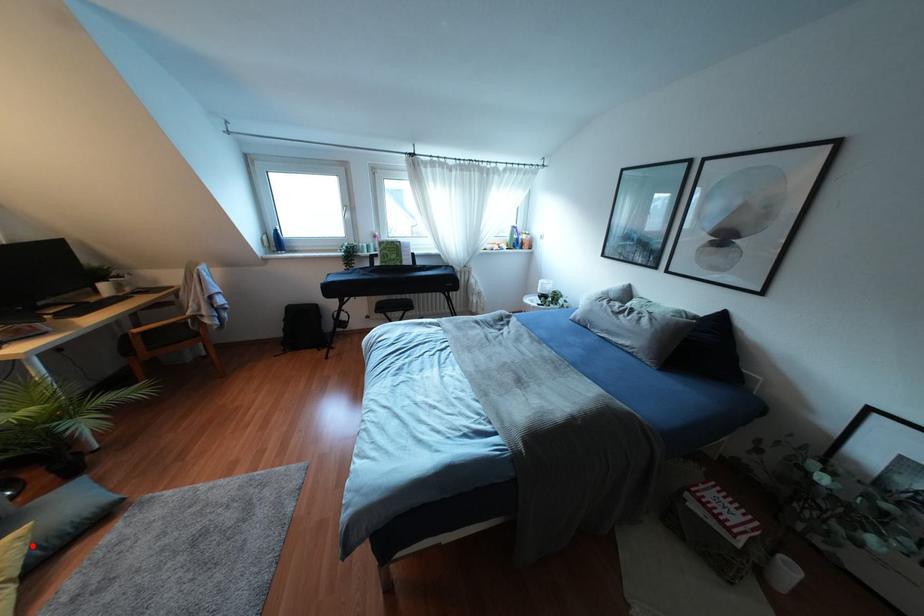
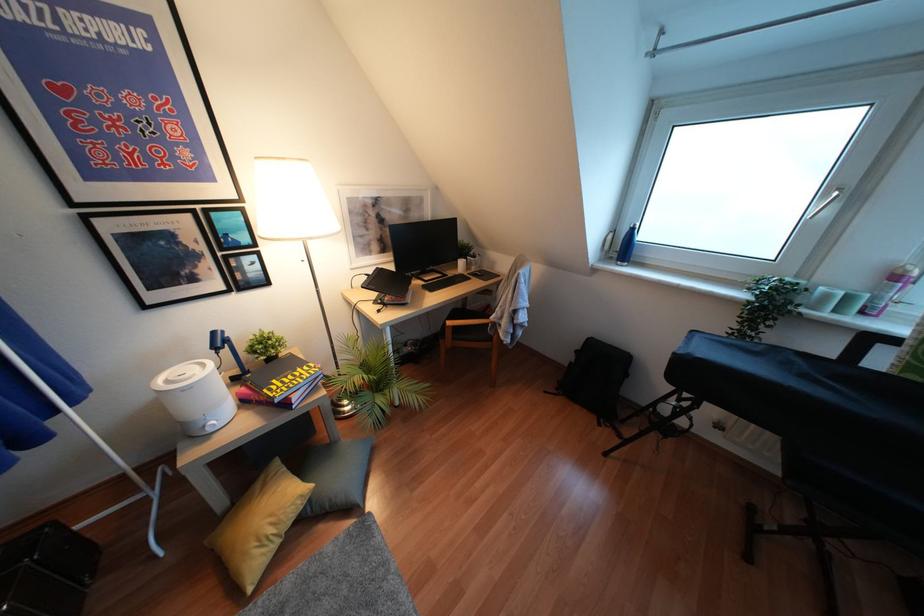
Where in the second image is the point corresponding to the highlighted location from the first image?

(310, 500)